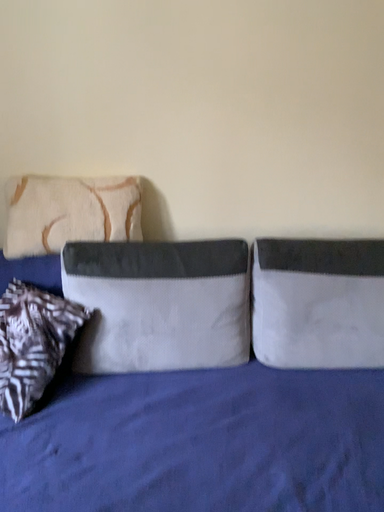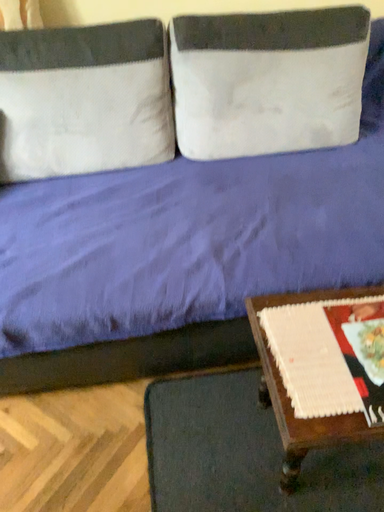
Question: How did the camera likely rotate when shooting the video?

Choices:
 (A) rotated downward
 (B) rotated upward

Answer: (A)